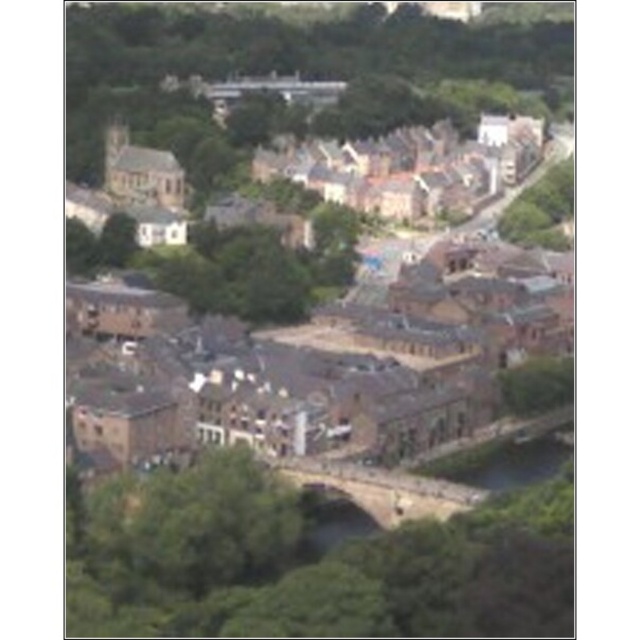
You are a GUI agent. You are given a task and a screenshot of the screen. Output one action in this format:
    pyautogui.click(x=<x>, y=<y>)
    Task: Click on the stone bridge at center
    This screenshot has width=640, height=640.
    Given the screenshot: What is the action you would take?
    pyautogui.click(x=381, y=488)

Who is positioned more to the right, stone bridge at center or green grassy river at lower center?

Positioned to the right is green grassy river at lower center.

Does point (340, 484) lie in front of point (566, 452)?

That is True.

This screenshot has width=640, height=640. I want to click on stone bridge at center, so click(381, 488).

Does brown stone bridge at center appear on the right side of green grassy river at lower center?

No, brown stone bridge at center is not to the right of green grassy river at lower center.

Does point (525, 445) come closer to viewer compared to point (500, 488)?

No.

Is point (483, 497) closer to camera compared to point (547, 461)?

Yes, point (483, 497) is closer to viewer.

Identify the location of brown stone bridge at center. (416, 486).

Can you confirm if brown stone bridge at center is bigger than stone bridge at center?

Yes, brown stone bridge at center is bigger than stone bridge at center.

Who is more forward, (353,499) or (396,472)?

Point (353,499) is in front.

You are a GUI agent. You are given a task and a screenshot of the screen. Output one action in this format:
    pyautogui.click(x=<x>, y=<y>)
    Task: Click on the brown stone bridge at center
    
    Given the screenshot: What is the action you would take?
    [416, 486]